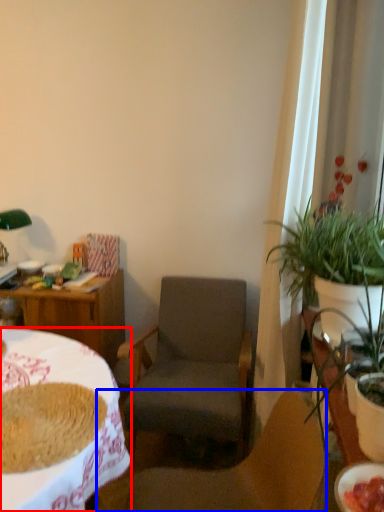
Question: Which object appears closest to the camera in this image, desk (highlighted by a red box) or chair (highlighted by a blue box)?

Choices:
 (A) desk
 (B) chair

Answer: (A)